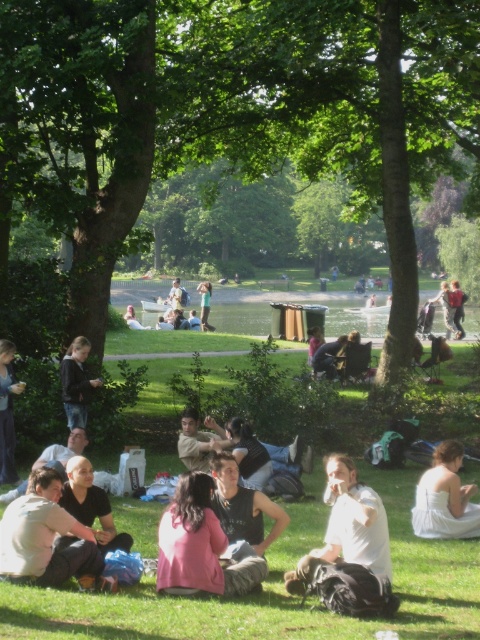
Question: Which point is closer to the camera?

Choices:
 (A) (346, 524)
 (B) (230, 499)
 (C) (352, 88)
 (D) (76, 458)

Answer: (A)

Question: Does dark brown leather jacket at center appear over matte black jacket at center?

Choices:
 (A) no
 (B) yes

Answer: (B)

Question: Is green leafy tree at center further to the viewer compared to dark blue jeans at lower left?

Choices:
 (A) yes
 (B) no

Answer: (B)

Question: Among these objects, which one is farthest from the camera?

Choices:
 (A) green leafy tree at center
 (B) light brown hair at center

Answer: (A)

Question: Can you confirm if white cotton shirt at center is smaller than light brown hair at center?

Choices:
 (A) no
 (B) yes

Answer: (B)

Question: Among these objects, which one is nearest to the camera?

Choices:
 (A) white satin dress at lower right
 (B) white cotton shirt at center

Answer: (B)